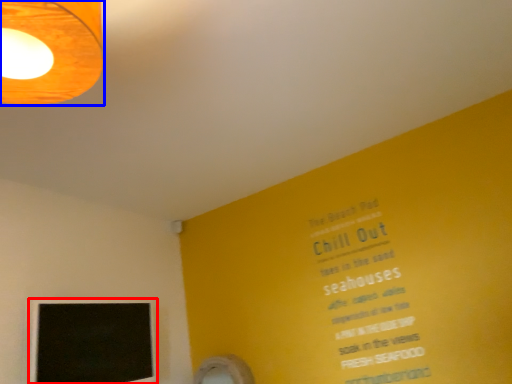
Question: Among these objects, which one is nearest to the camera, computer monitor (highlighted by a red box) or lamp (highlighted by a blue box)?

Choices:
 (A) computer monitor
 (B) lamp

Answer: (B)